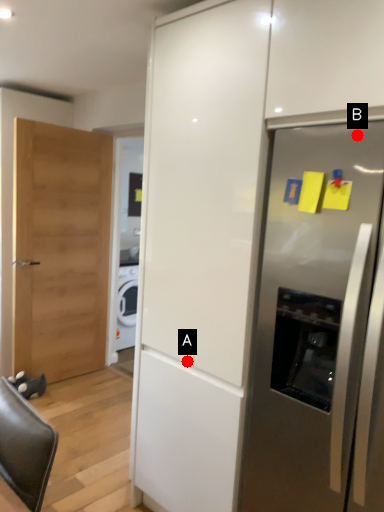
Question: Two points are circled on the image, labeled by A and B beside each circle. Which point is closer to the camera?

Choices:
 (A) A is closer
 (B) B is closer

Answer: (B)